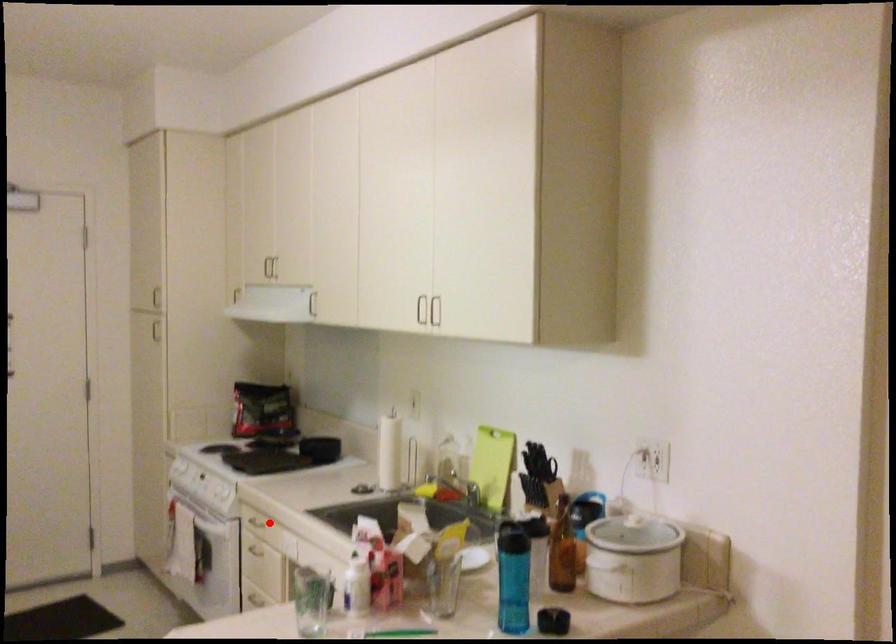
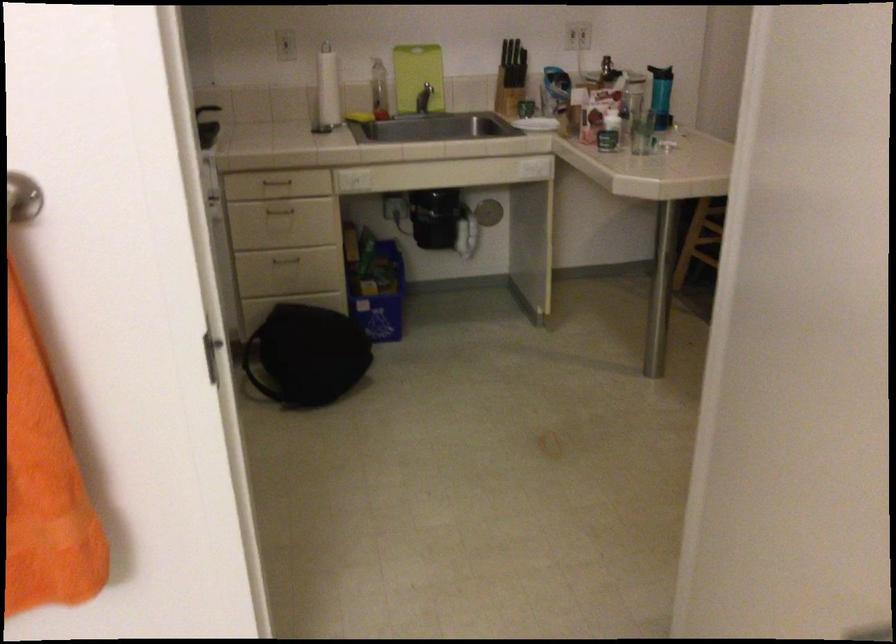
Locate, in the second image, the point that corresponds to the highlighted location in the first image.

(277, 183)